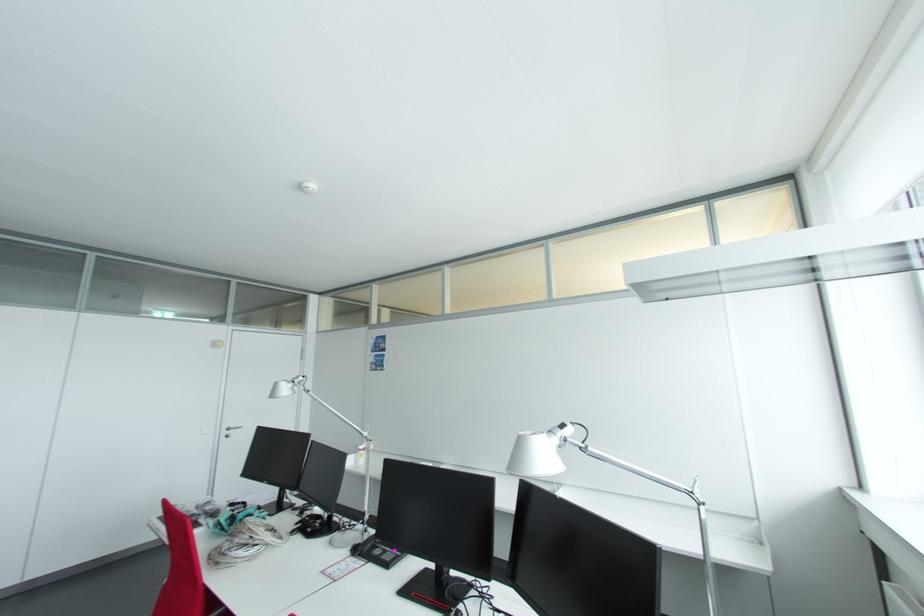
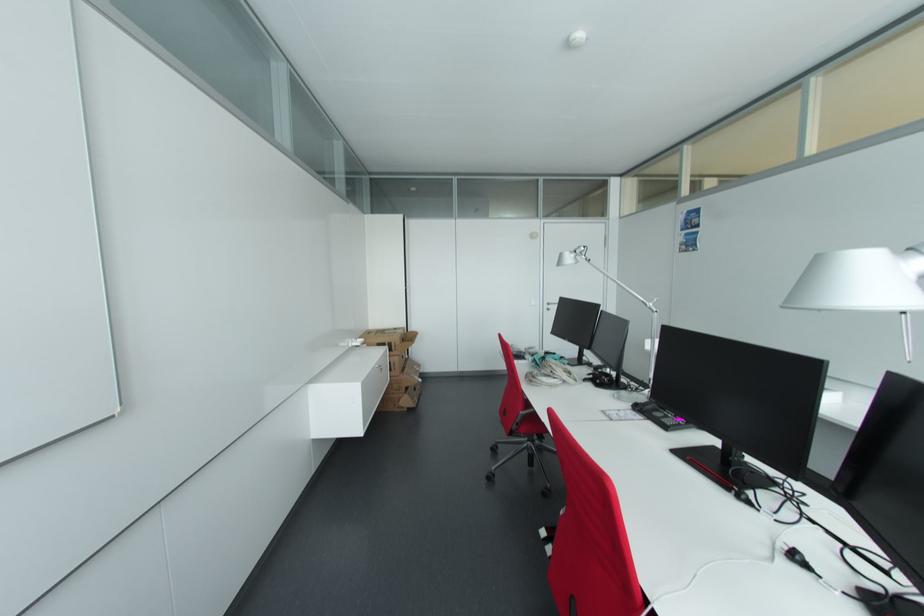
Question: The camera is either moving clockwise (left) or counter-clockwise (right) around the object. The first image is from the beginning of the video and the second image is from the end. Is the camera moving left or right when shooting the video?

Choices:
 (A) Left
 (B) Right

Answer: (B)